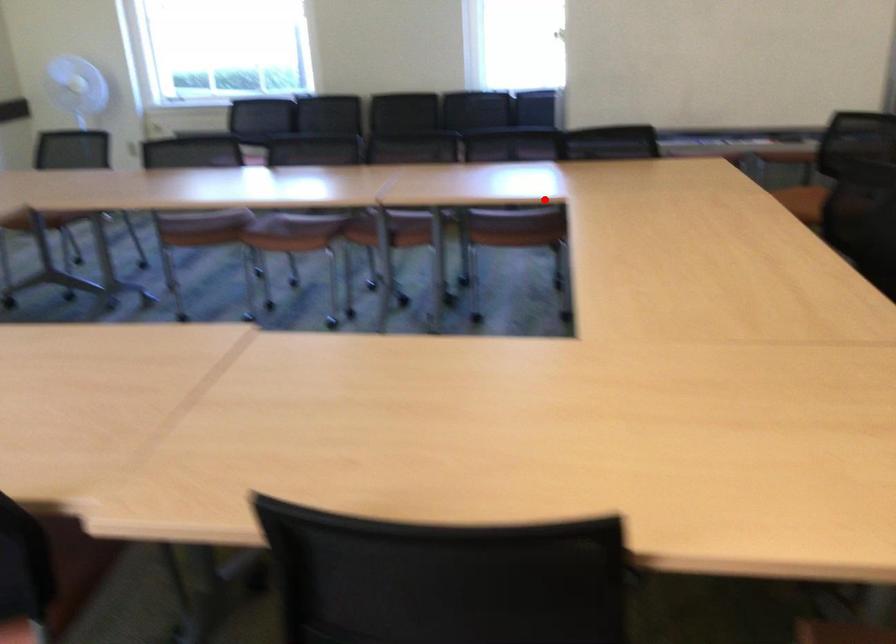
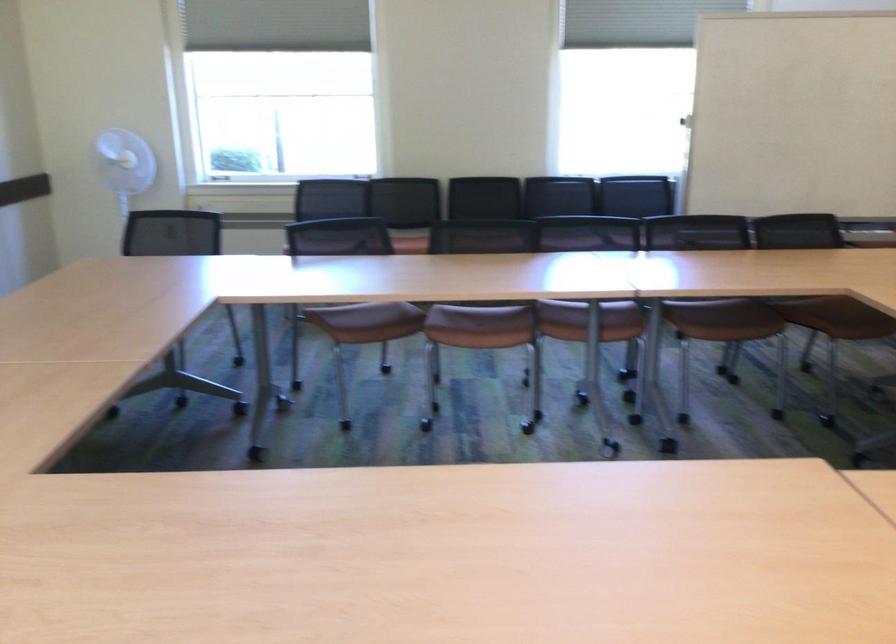
In the second image, find the point that corresponds to the highlighted location in the first image.

(820, 295)